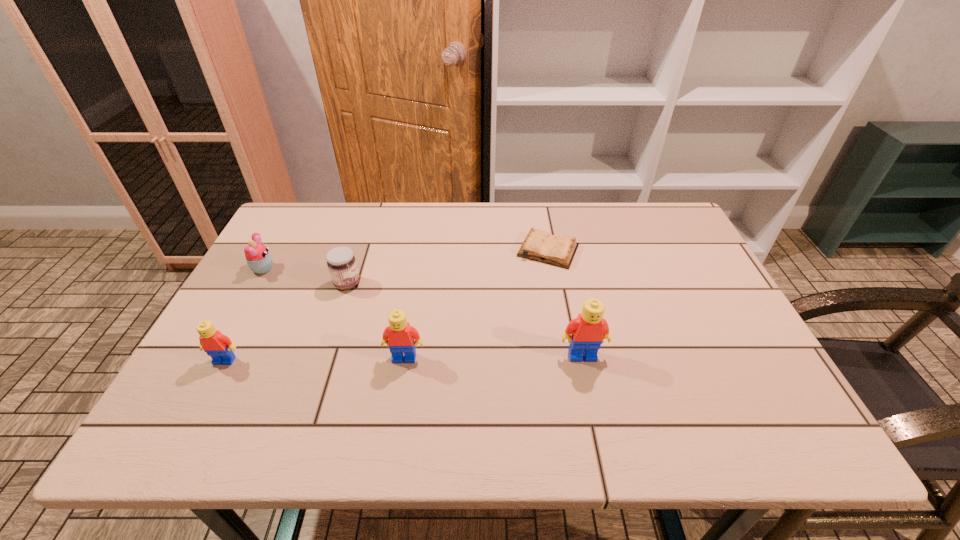
Find the location of a particular element. This screenshot has height=540, width=960. vacant point located between the cupcake and the fifth shortest object is located at coordinates (334, 313).

Image resolution: width=960 pixels, height=540 pixels. Identify the location of blank region between the shortest object and the jam. (447, 267).

This screenshot has width=960, height=540. I want to click on vacant area between the leftmost Lego and the third object from left to right, so click(286, 322).

Identify which object is the third closest to the leftmost Lego. Please provide its 2D coordinates. Your answer should be formatted as a tuple, i.e. [(x, y)], where the tuple contains the x and y coordinates of a point satisfying the conditions above.

[(399, 336)]

Locate an element on the screen. object that ranks as the second closest to the leftmost Lego is located at coordinates (259, 260).

The height and width of the screenshot is (540, 960). Identify the location of Lego that is the third nearest to the diary. (217, 345).

What are the coordinates of `Lego that is the second nearest to the rightmost Lego` in the screenshot? It's located at (217, 345).

Identify the location of free space that satisfies the following two spatial constraints: 1. on the front side of the diary; 2. on the face of the cupcake. This screenshot has width=960, height=540. (551, 269).

The height and width of the screenshot is (540, 960). Identify the location of free region that satisfies the following two spatial constraints: 1. on the front label of the third object from left to right; 2. on the face of the shortest Lego. click(322, 360).